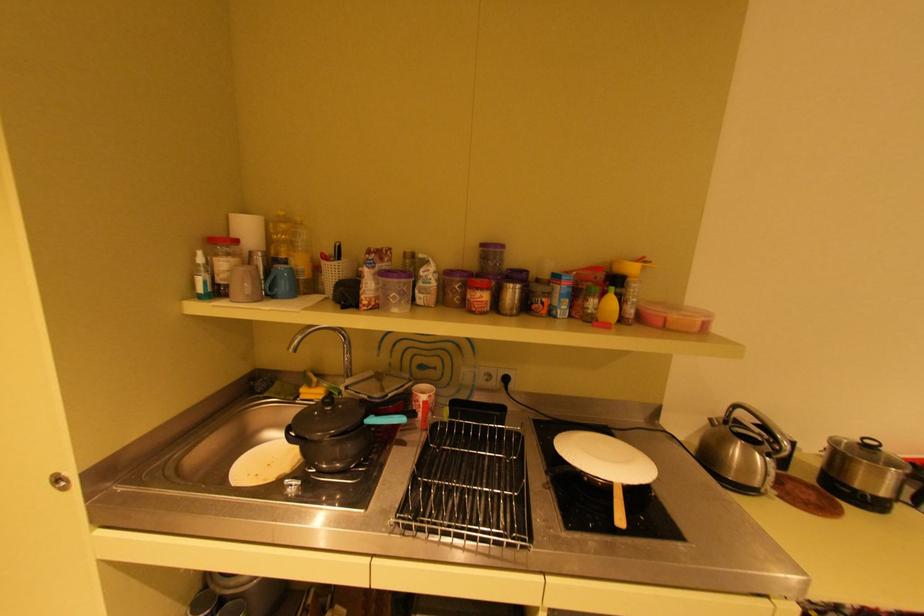
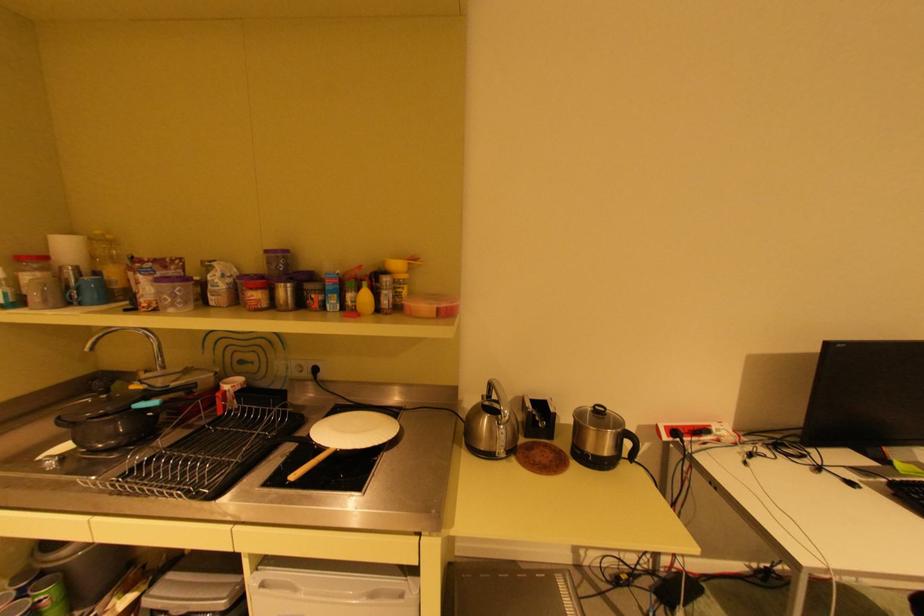
The point at [371,424] is marked in the first image. Where is the corresponding point in the second image?

(139, 408)